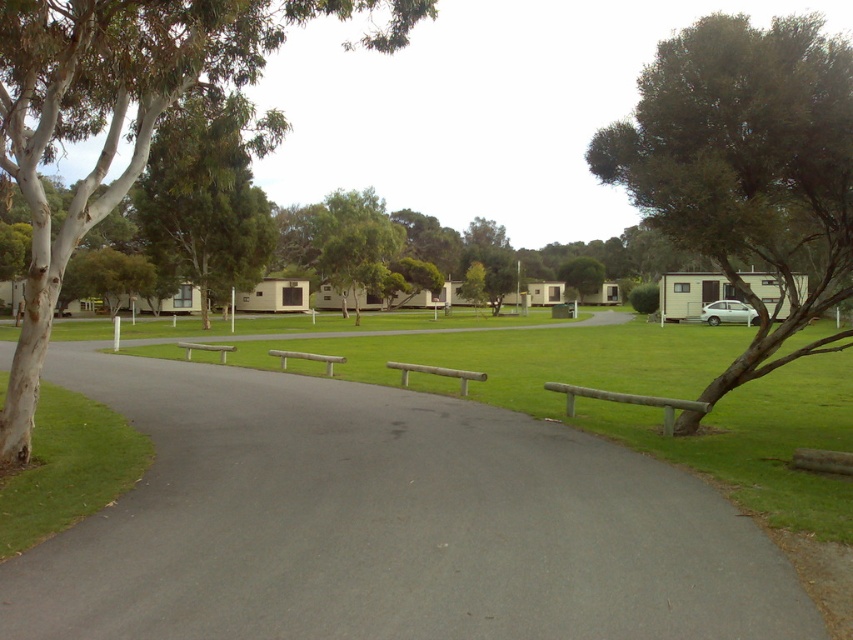
You are driving a delivery van that is 2.5 meters tall. You need to pass under the green leafy tree at center and the gray asphalt driveway at center. Will your van clear the height requirement?

The gray asphalt driveway at center has a lesser height compared to the green leafy tree at center. Since the driveway is lower, the van must pass under the tree first. However, the tree is taller than the driveway. Without knowing the exact height of the tree, it is uncertain if the van will clear it. Please check the tree height before proceeding.

You are a gardener planning to plant a new tree in this area. Considering the gray asphalt driveway at center and the green leafy tree at center, which object is located above the other?

The green leafy tree at center is located above the gray asphalt driveway at center because the driveway is positioned under the tree.

You are standing at the point marked by the coordinates point (207, 193) in the image. Looking around, what is the most prominent object directly in front of you?

The point (207, 193) marks green leafy tree at upper left, so the most prominent object directly in front would be the green leafy tree at upper left.